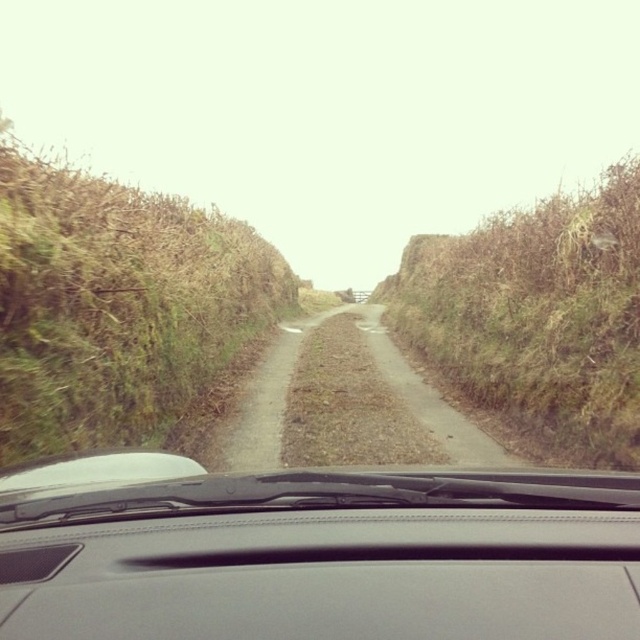
Who is taller, black matte windshield wiper at center or brown grassy hedge at right?

brown grassy hedge at right is taller.

Does black matte windshield wiper at center appear on the left side of brown grassy hedge at right?

Indeed, black matte windshield wiper at center is positioned on the left side of brown grassy hedge at right.

Does point (497, 604) lie in front of point (637, 422)?

Yes, it is in front of point (637, 422).

This screenshot has width=640, height=640. Identify the location of black matte windshield wiper at center. (324, 556).

Who is shorter, green grassy hedge at left or dirt/gravel road at center?

With less height is dirt/gravel road at center.

Is green grassy hedge at left in front of dirt/gravel road at center?

Yes, green grassy hedge at left is closer to the viewer.

The image size is (640, 640). Identify the location of green grassy hedge at left. (118, 307).

I want to click on green grassy hedge at left, so click(118, 307).

Who is shorter, brown grassy hedge at right or dirt/gravel road at center?

dirt/gravel road at center is shorter.

Does brown grassy hedge at right appear on the left side of dirt/gravel road at center?

No, brown grassy hedge at right is not to the left of dirt/gravel road at center.

Who is more distant from viewer, (486, 364) or (250, 464)?

Point (486, 364)

I want to click on brown grassy hedge at right, so click(538, 317).